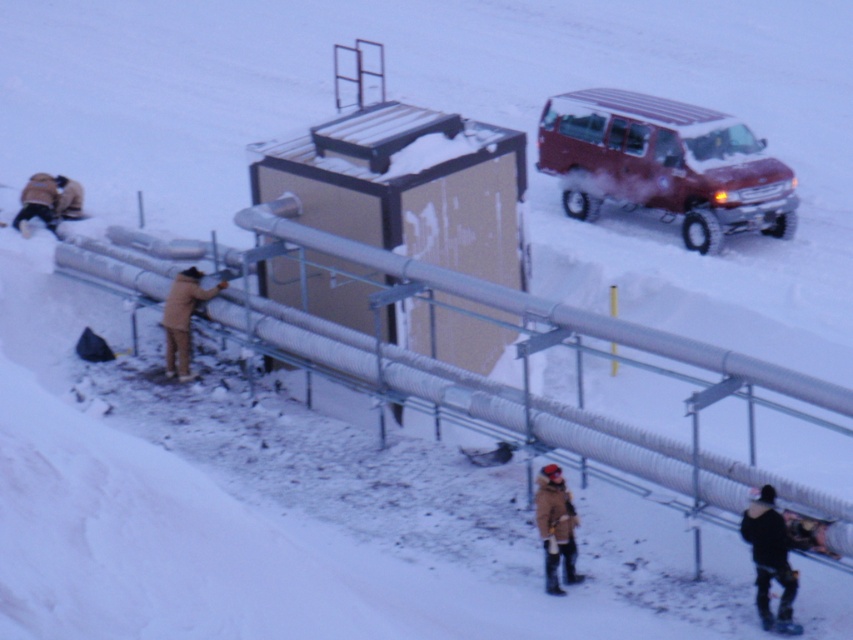
Question: Is matte red van at upper right above dark gray jacket at lower right?

Choices:
 (A) no
 (B) yes

Answer: (B)

Question: Which point is farther from the camera taking this photo?

Choices:
 (A) (764, 499)
 (B) (198, 298)
 (C) (77, 214)

Answer: (C)

Question: Observing the image, what is the correct spatial positioning of matte red van at upper right in reference to brown fuzzy coat at lower center?

Choices:
 (A) below
 (B) above

Answer: (B)

Question: Is matte red van at upper right wider than brown fuzzy coat at lower center?

Choices:
 (A) yes
 (B) no

Answer: (A)

Question: Estimate the real-world distances between objects in this image. Which object is closer to the beige wool jacket at lower left?

Choices:
 (A) matte red van at upper right
 (B) brown fuzzy coat at lower center
 (C) dark gray jacket at lower right
 (D) brown woolen jacket at left

Answer: (D)

Question: Which point is closer to the camera taking this photo?

Choices:
 (A) [x=577, y=160]
 (B) [x=54, y=208]

Answer: (B)